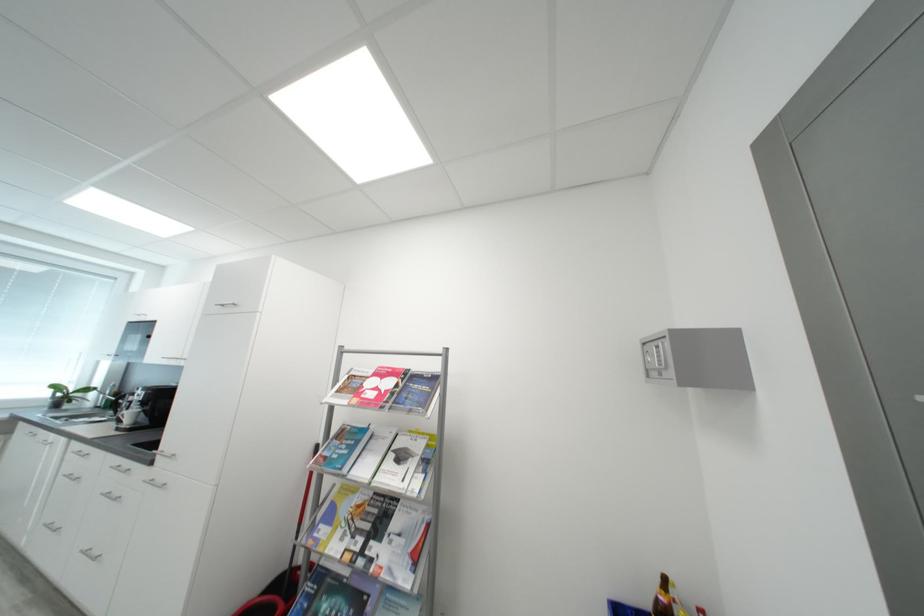
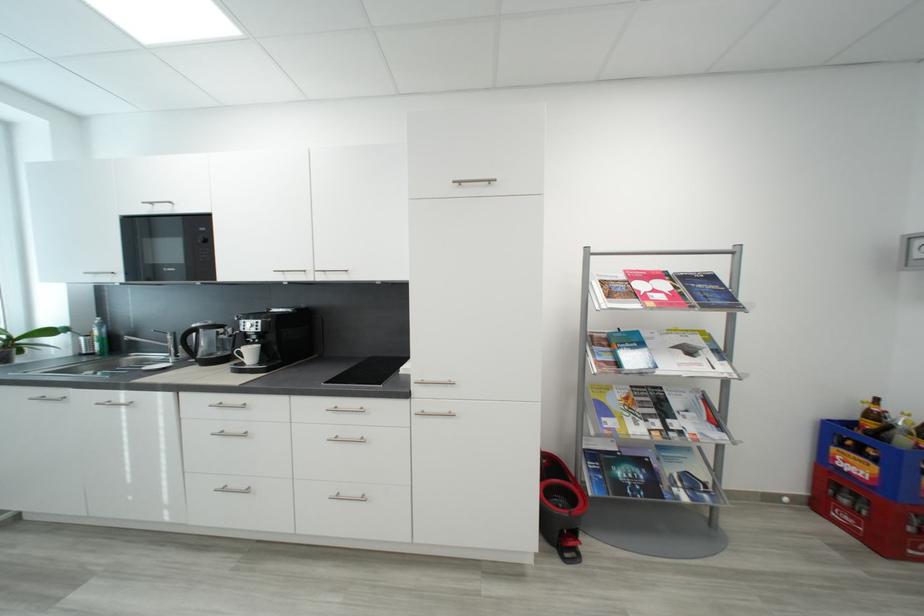
Question: In a continuous first-person perspective shot, in which direction is the camera moving?

Choices:
 (A) Left
 (B) Right
 (C) Forward
 (D) Backward

Answer: (A)